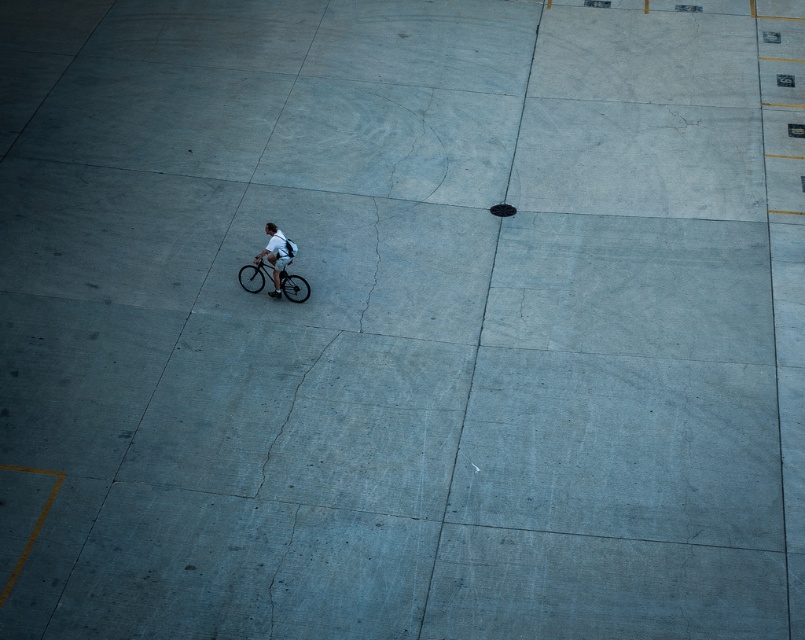
Question: Among these points, which one is nearest to the camera?

Choices:
 (A) 283,237
 (B) 250,280

Answer: (A)

Question: Is shiny metallic bicycle at center closer to camera compared to matte black bicycle at center?

Choices:
 (A) no
 (B) yes

Answer: (A)

Question: Does shiny metallic bicycle at center have a lesser width compared to matte black bicycle at center?

Choices:
 (A) no
 (B) yes

Answer: (B)

Question: Is shiny metallic bicycle at center above matte black bicycle at center?

Choices:
 (A) yes
 (B) no

Answer: (B)

Question: Which of the following is the closest to the observer?

Choices:
 (A) shiny metallic bicycle at center
 (B) matte black bicycle at center

Answer: (B)